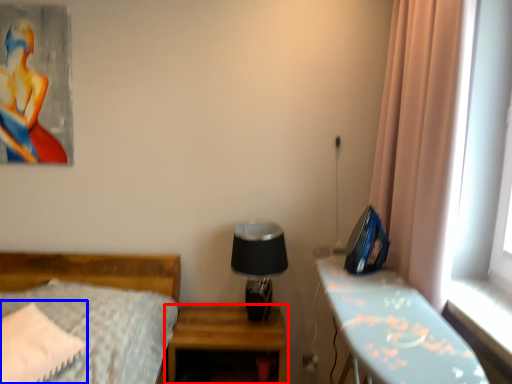
Question: Which object is closer to the camera taking this photo, nightstand (highlighted by a red box) or pillow (highlighted by a blue box)?

Choices:
 (A) nightstand
 (B) pillow

Answer: (B)